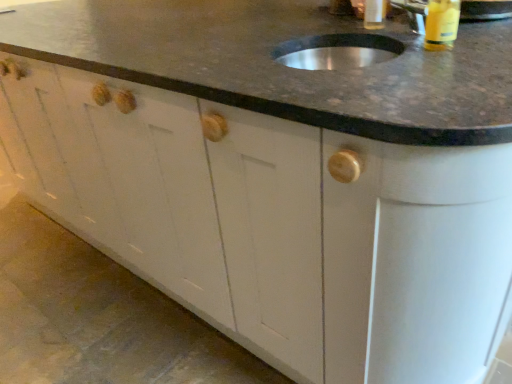
Question: Is translucent plastic bottle at upper center, positioned as the 1th beverage in left-to-right order, in front of yellow plastic bottle at upper right, the 1th beverage in the front-to-back sequence?

Choices:
 (A) no
 (B) yes

Answer: (A)

Question: Does translucent plastic bottle at upper center, acting as the second beverage starting from the right, have a greater width compared to yellow plastic bottle at upper right, which is counted as the second beverage, starting from the back?

Choices:
 (A) yes
 (B) no

Answer: (B)

Question: From a real-world perspective, is translucent plastic bottle at upper center, which appears as the 2th beverage when viewed from the front, positioned under yellow plastic bottle at upper right, the 1th beverage in the front-to-back sequence, based on gravity?

Choices:
 (A) yes
 (B) no

Answer: (B)

Question: Is translucent plastic bottle at upper center, which appears as the 2th beverage when viewed from the front, oriented towards yellow plastic bottle at upper right, which is the second beverage in left-to-right order?

Choices:
 (A) yes
 (B) no

Answer: (B)

Question: From the image's perspective, is translucent plastic bottle at upper center, which is the first beverage from back to front, beneath yellow plastic bottle at upper right, positioned as the 1th beverage in right-to-left order?

Choices:
 (A) no
 (B) yes

Answer: (A)

Question: Is point (445, 31) positioned closer to the camera than point (337, 61)?

Choices:
 (A) farther
 (B) closer

Answer: (B)

Question: In the image, is yellow plastic bottle at upper right, which is the second beverage in left-to-right order, on the left side or the right side of metallic silver sink at upper center?

Choices:
 (A) right
 (B) left

Answer: (A)

Question: Looking at their shapes, would you say yellow plastic bottle at upper right, which is counted as the second beverage, starting from the back, is wider or thinner than metallic silver sink at upper center?

Choices:
 (A) thin
 (B) wide

Answer: (A)

Question: From the image's perspective, is yellow plastic bottle at upper right, which is counted as the second beverage, starting from the back, positioned above or below metallic silver sink at upper center?

Choices:
 (A) above
 (B) below

Answer: (B)

Question: Do you think translucent plastic bottle at upper center, positioned as the 1th beverage in left-to-right order, is within yellow plastic bottle at upper right, the 1th beverage in the front-to-back sequence, or outside of it?

Choices:
 (A) inside
 (B) outside

Answer: (B)

Question: From a real-world perspective, is translucent plastic bottle at upper center, positioned as the 1th beverage in left-to-right order, above or below yellow plastic bottle at upper right, the 1th beverage in the front-to-back sequence?

Choices:
 (A) below
 (B) above

Answer: (B)

Question: From the image's perspective, is translucent plastic bottle at upper center, which appears as the 2th beverage when viewed from the front, located above or below yellow plastic bottle at upper right, which is the second beverage in left-to-right order?

Choices:
 (A) above
 (B) below

Answer: (A)

Question: In terms of height, does translucent plastic bottle at upper center, positioned as the 1th beverage in left-to-right order, look taller or shorter compared to yellow plastic bottle at upper right, which is counted as the second beverage, starting from the back?

Choices:
 (A) tall
 (B) short

Answer: (A)

Question: Visually, is yellow plastic bottle at upper right, which is counted as the second beverage, starting from the back, positioned to the left or to the right of translucent plastic bottle at upper center, acting as the second beverage starting from the right?

Choices:
 (A) right
 (B) left

Answer: (A)

Question: From their relative heights in the image, would you say yellow plastic bottle at upper right, which is the second beverage in left-to-right order, is taller or shorter than translucent plastic bottle at upper center, positioned as the 1th beverage in left-to-right order?

Choices:
 (A) tall
 (B) short

Answer: (B)